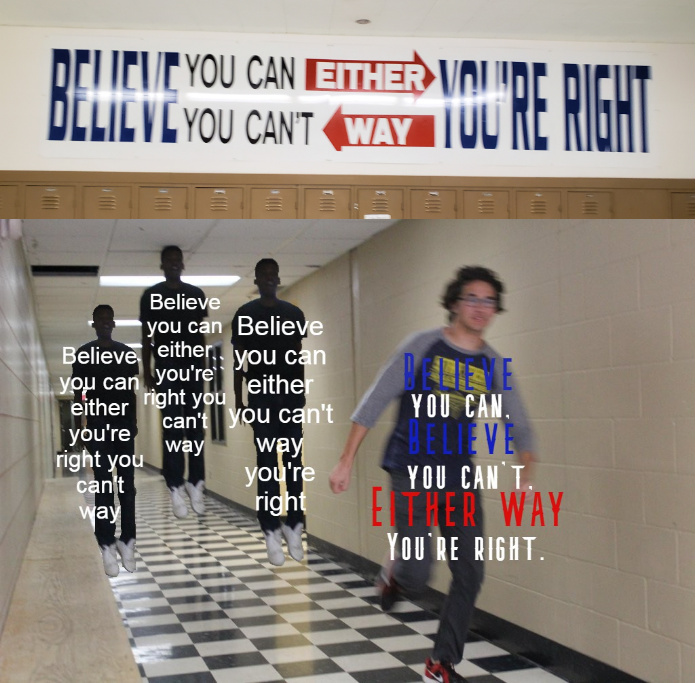
This screenshot has height=683, width=696. I want to click on brick wall, so click(x=619, y=317).